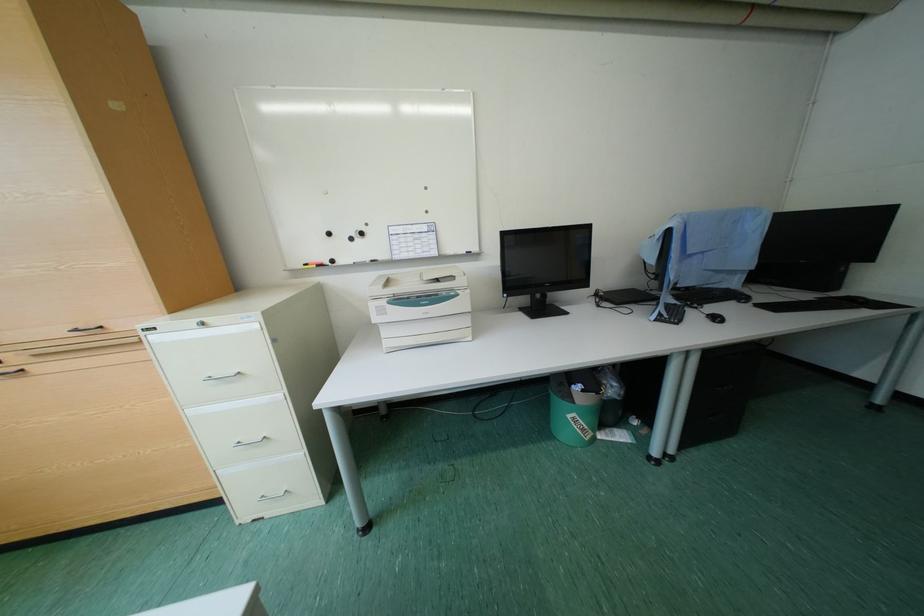
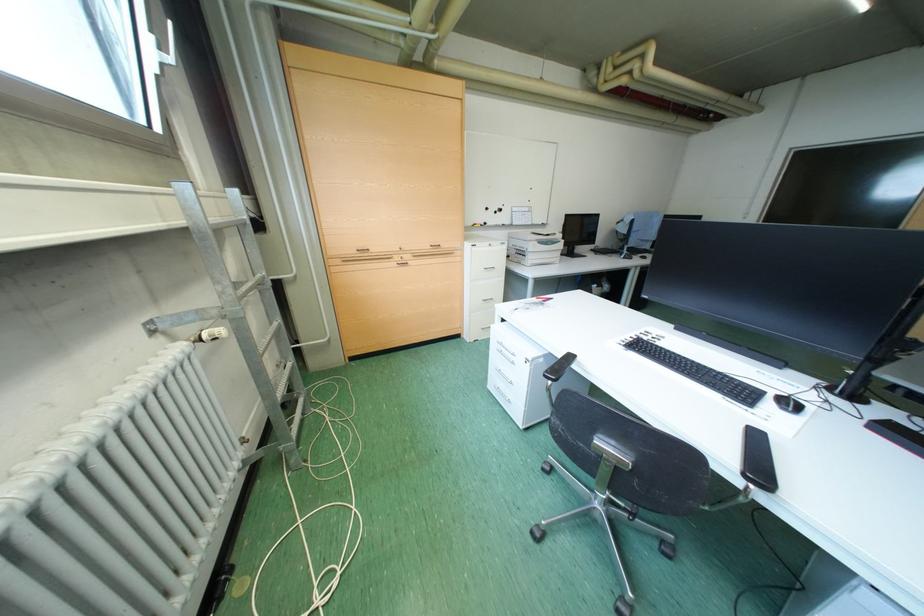
Based on the photo, in a continuous first-person perspective shot, in which direction is the camera moving?

The cameraman walked toward left, backward.